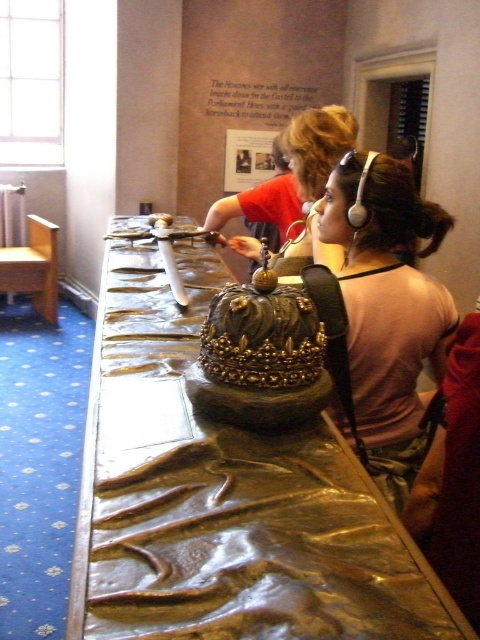
You are a visitor at the museum and want to take a photo of the matte gold crown at center without the gold polished wood table at center appearing in the frame. Is it possible to do so based on their heights?

The gold polished wood table at center is taller than the matte gold crown at center, so it might block the view. However, since both are at the center, adjusting the camera angle downward could allow capturing the matte gold crown at center while avoiding the table.

You are a visitor standing in front of the gold polished wood table at center and the matte gold crown at center. Which object is nearer to you?

The gold polished wood table at center is closer to the viewer than the matte gold crown at center.

You are a visitor in the museum and see the gold polished wood table at center and the pink fabric at center. Which object is placed higher in the image?

The gold polished wood table at center is above the pink fabric at center, so it is placed higher in the image.